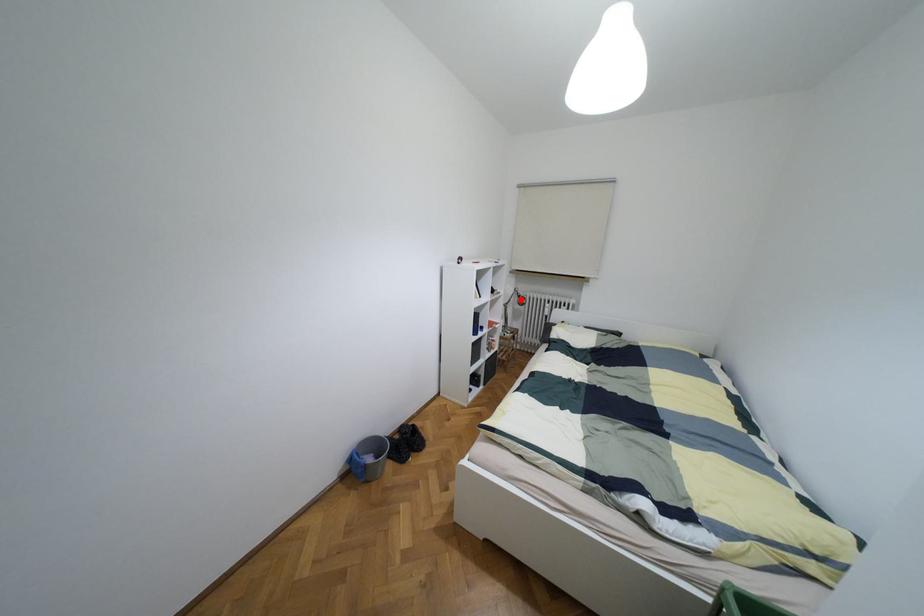
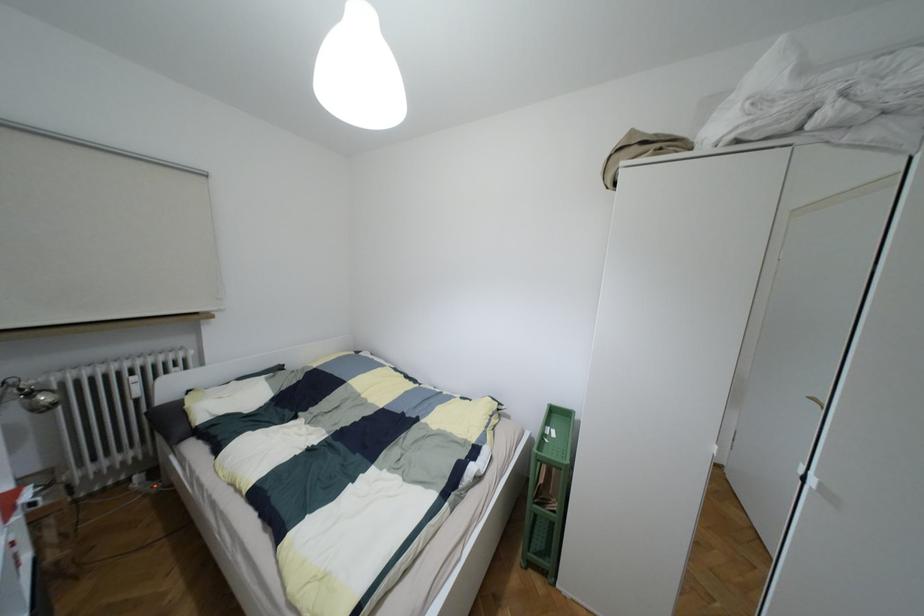
The point at the highlighted location is marked in the first image. Where is the corresponding point in the second image?

(43, 397)